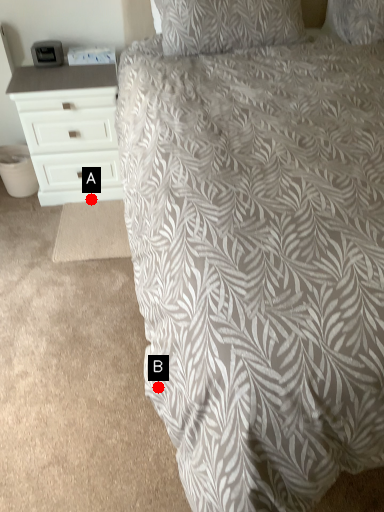
Question: Two points are circled on the image, labeled by A and B beside each circle. Which point is farther to the camera?

Choices:
 (A) A is further
 (B) B is further

Answer: (A)